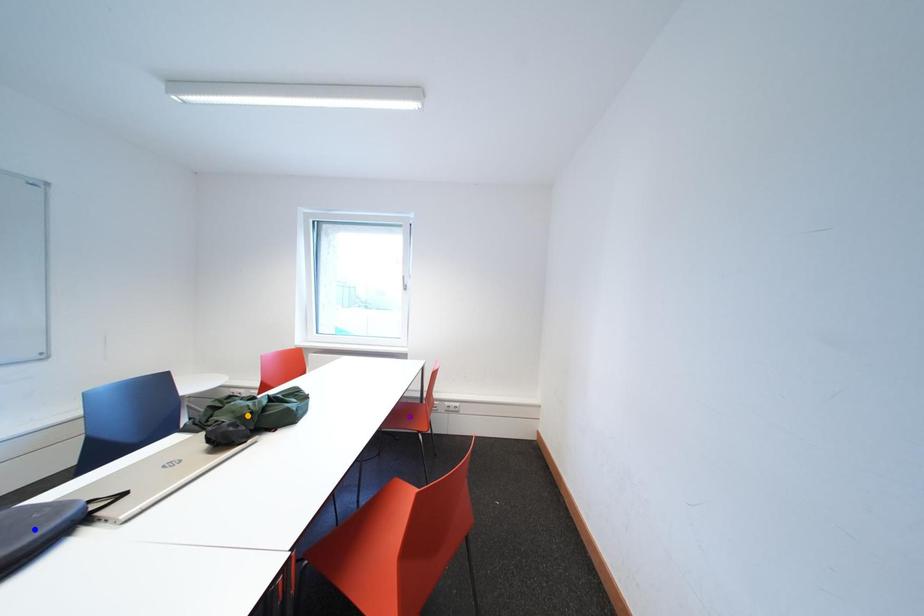
Order these from nearest to farthest:
A) blue point
B) orange point
C) purple point

blue point < orange point < purple point